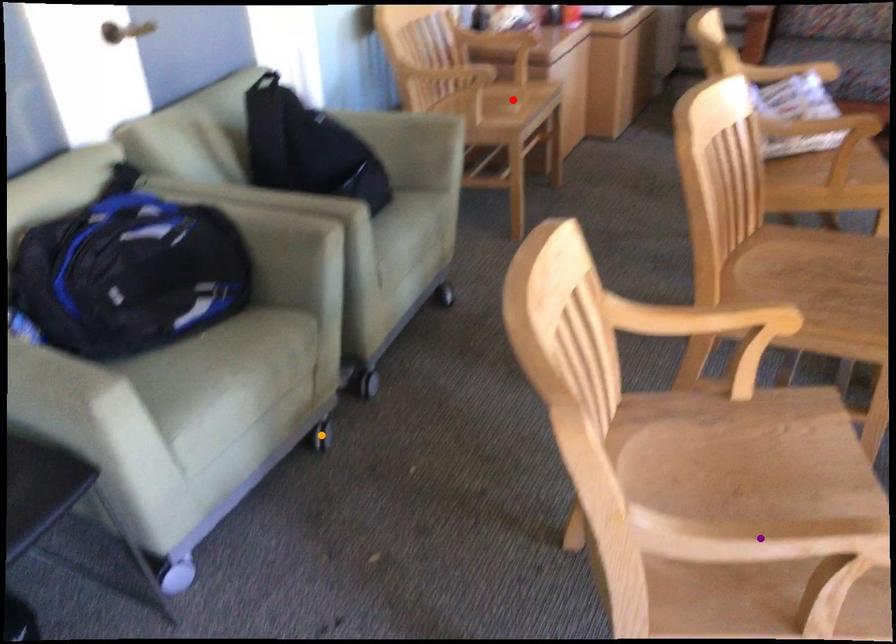
Order these from nearest to farthest:
purple point, red point, orange point

purple point → orange point → red point